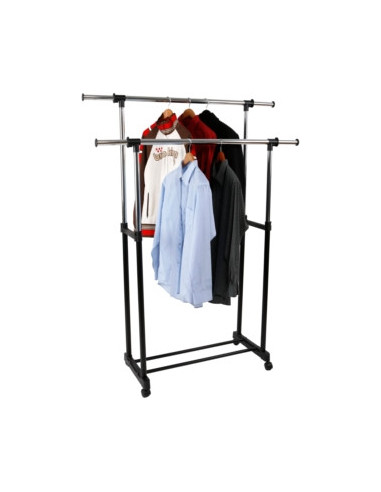
Identify the location of coat hangers. (165, 112), (187, 110), (205, 111), (187, 157), (219, 156).